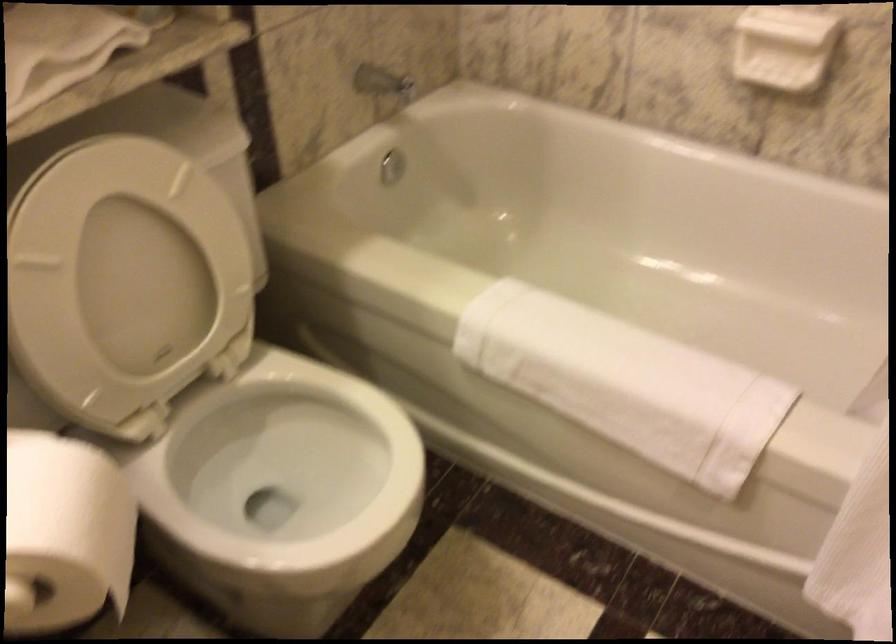
Where is `white toilet seat`? white toilet seat is located at coordinates click(x=281, y=464).